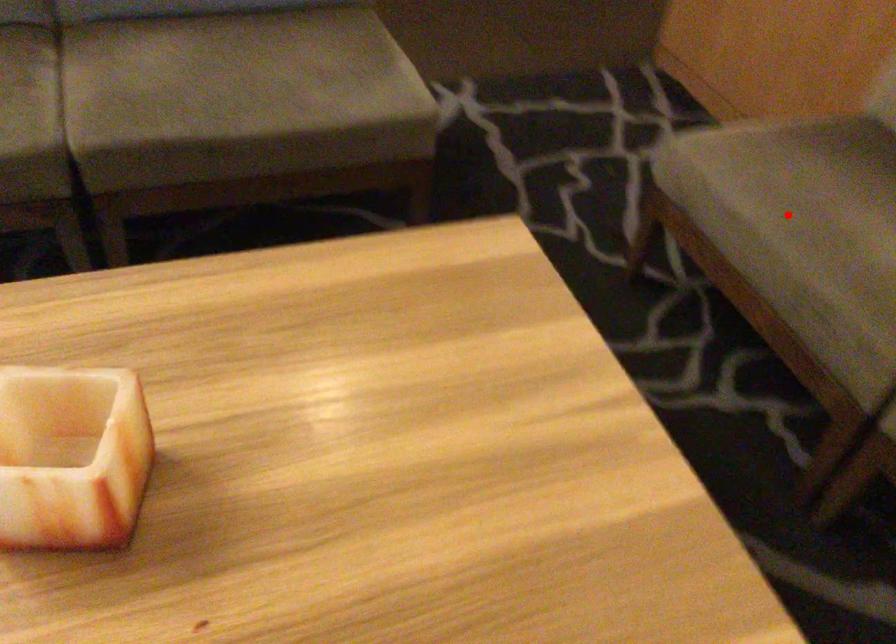
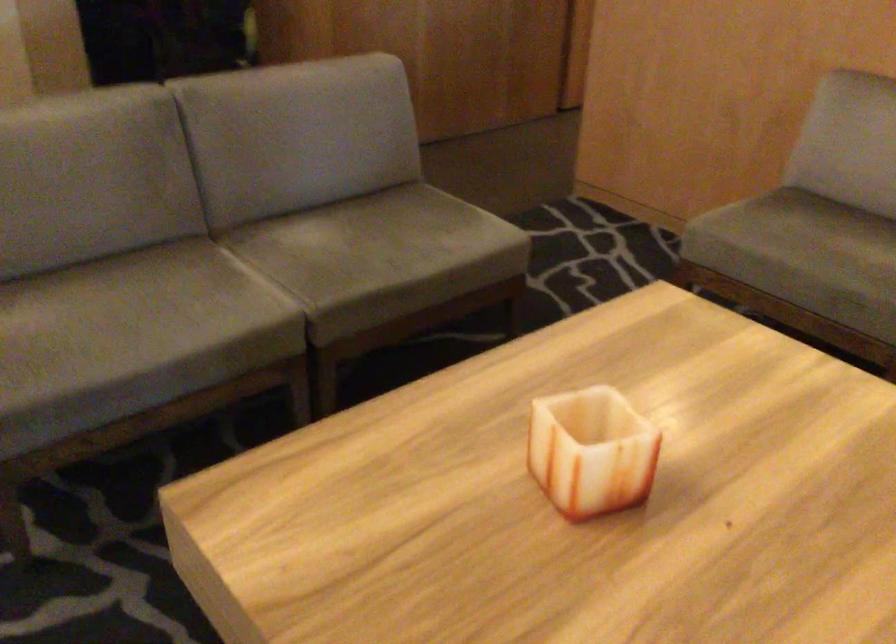
Where in the second image is the point corresponding to the highlighted location from the first image?

(798, 245)